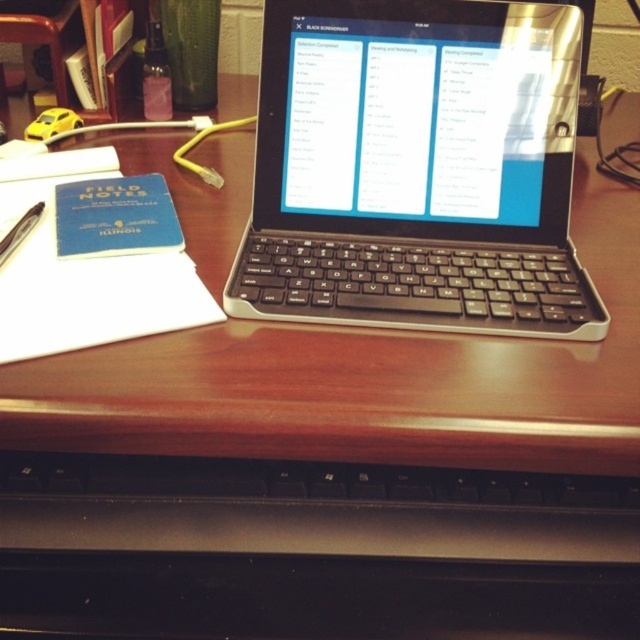
Who is more forward, (x=97, y=248) or (x=20, y=221)?

Point (x=97, y=248)

Who is taller, blue paper at left or metallic pen at left?

blue paper at left is taller.

The image size is (640, 640). What do you see at coordinates (115, 216) in the screenshot? I see `blue paper at left` at bounding box center [115, 216].

At what (x,y) coordinates should I click in order to perform the action: click on blue paper at left. Please return your answer as a coordinate pair (x, y). Looking at the image, I should click on click(x=115, y=216).

Is wooden table at center bigger than white paper at left?

Yes, wooden table at center is bigger than white paper at left.

Which is in front, point (288, 408) or point (38, 186)?

Point (288, 408) is in front.

Between point (276, 344) and point (81, 342), which one is positioned behind?

The point (276, 344) is behind.

This screenshot has width=640, height=640. I want to click on wooden table at center, so click(x=364, y=381).

Is the position of black plastic keyboard at center more distant than that of metallic pen at left?

→ That is False.

Is point (397, 61) more distant than point (29, 221)?

That is False.

Identify the location of black plastic keyboard at center. This screenshot has width=640, height=640. (417, 170).